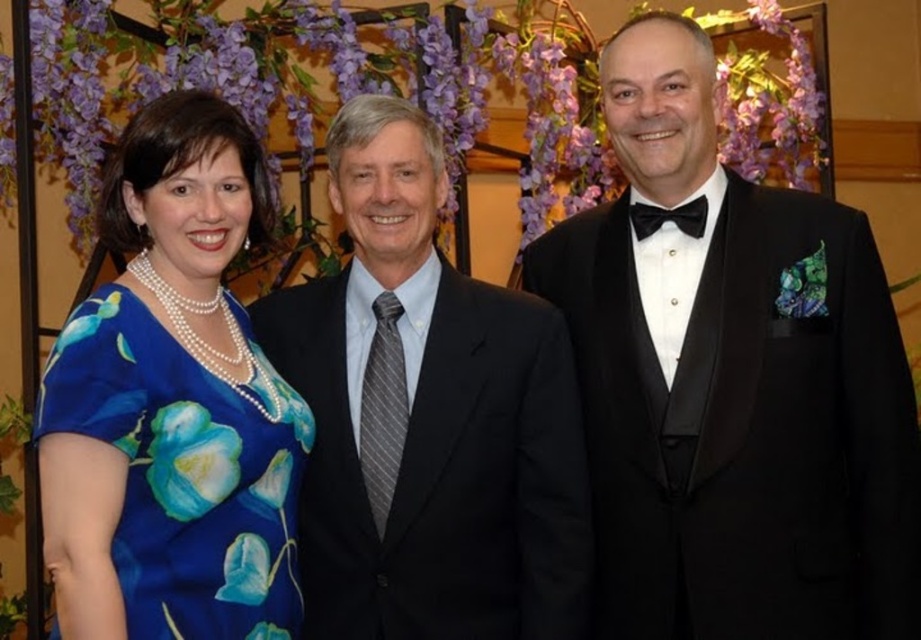
Between point (446, 264) and point (91, 509), which one is positioned in front?

Point (91, 509) is in front.

Does black satin suit at center appear on the right side of blue satin dress at left?

Yes, black satin suit at center is to the right of blue satin dress at left.

Measure the distance between black satin suit at center and camera.

black satin suit at center and camera are 1.71 meters apart from each other.

Find the location of a particular element. black satin suit at center is located at coordinates [x=427, y=417].

The image size is (921, 640). What do you see at coordinates (427, 417) in the screenshot?
I see `black satin suit at center` at bounding box center [427, 417].

Which of these two, black satin suit at center or black satin bow tie at center, stands shorter?

With less height is black satin bow tie at center.

Where is `black satin suit at center`? The width and height of the screenshot is (921, 640). black satin suit at center is located at coordinates (427, 417).

Which of these two, black satin tuxedo at center or blue satin dress at left, stands taller?

black satin tuxedo at center is taller.

Describe the element at coordinates (732, 384) in the screenshot. This screenshot has width=921, height=640. I see `black satin tuxedo at center` at that location.

Between point (580, 328) and point (67, 522), which one is positioned behind?

Point (580, 328)

Find the location of a particular element. The width and height of the screenshot is (921, 640). black satin tuxedo at center is located at coordinates (732, 384).